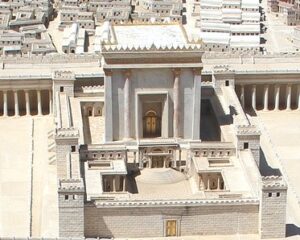
At what (x,y) coordinates should I click in order to perform the action: click on door. Please return your answer as a coordinate pair (x, y). Image resolution: width=300 pixels, height=240 pixels. Looking at the image, I should click on (149, 125).